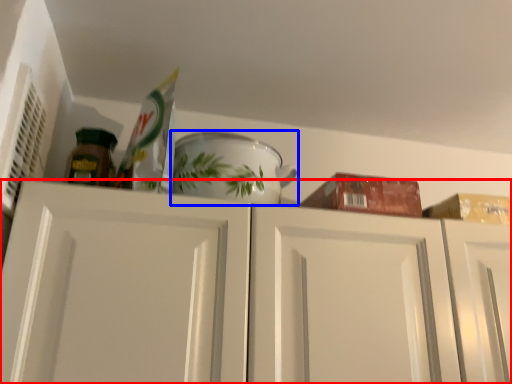
Question: Which object appears closest to the camera in this image, cabinetry (highlighted by a red box) or tableware (highlighted by a blue box)?

Choices:
 (A) cabinetry
 (B) tableware

Answer: (A)